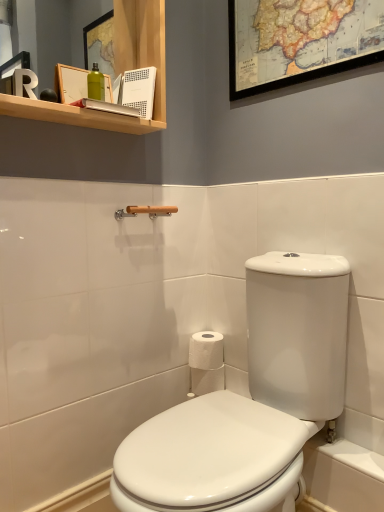
Question: Does point (215, 382) appear closer or farther from the camera than point (144, 499)?

Choices:
 (A) farther
 (B) closer

Answer: (A)

Question: In terms of size, does white paper at center appear bigger or smaller than white glossy toilet at center?

Choices:
 (A) big
 (B) small

Answer: (B)

Question: Which object is positioned closest to the wooden shelf at upper left?

Choices:
 (A) wooden map at upper center
 (B) white paper at center
 (C) white glossy toilet at center
 (D) wooden towel bar at upper center

Answer: (D)

Question: Which of these objects is positioned farthest from the wooden towel bar at upper center?

Choices:
 (A) white glossy toilet at center
 (B) white paper at center
 (C) wooden shelf at upper left
 (D) wooden map at upper center

Answer: (A)